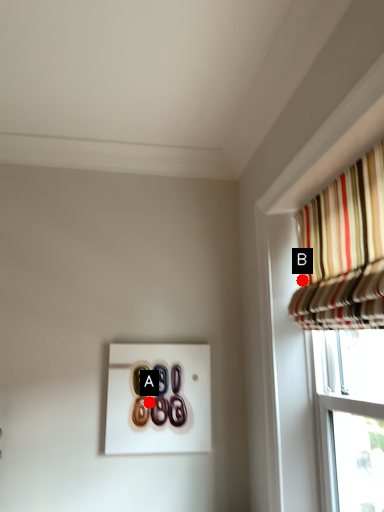
Question: Two points are circled on the image, labeled by A and B beside each circle. Which point appears closest to the camera in this image?

Choices:
 (A) A is closer
 (B) B is closer

Answer: (B)